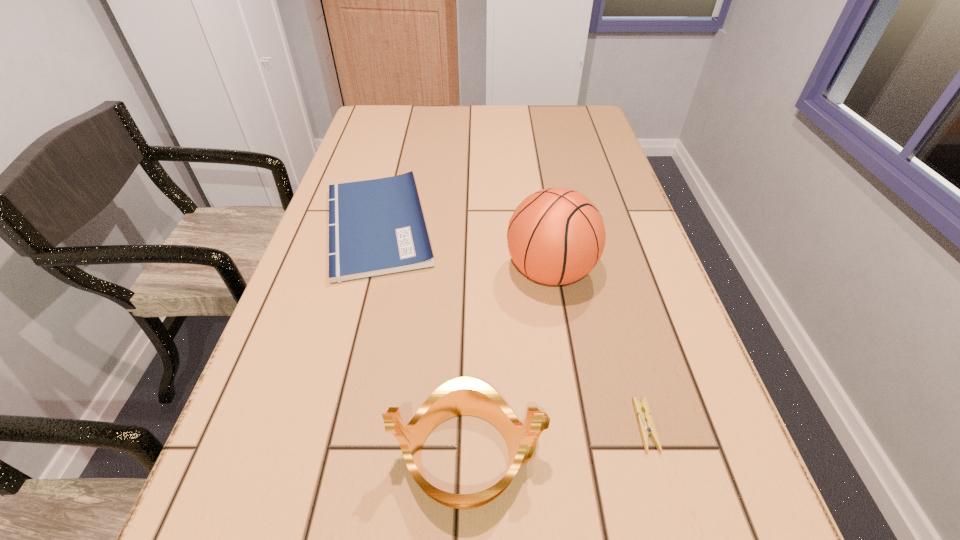
I want to click on the tallest object, so click(x=556, y=236).

Identify the location of tiara. The image size is (960, 540). (464, 395).

Find the location of a particular element. This screenshot has height=540, width=960. paperback book is located at coordinates (376, 227).

This screenshot has width=960, height=540. I want to click on clothespin, so click(647, 428).

Find the location of a particular element. The height and width of the screenshot is (540, 960). the shortest object is located at coordinates (647, 428).

You are a GUI agent. You are given a task and a screenshot of the screen. Output one action in this format:
    pyautogui.click(x=<x>, y=<y>)
    Task: Click on the free spot located 0.060m on the back of the basketball
    
    Given the screenshot: What is the action you would take?
    pyautogui.click(x=542, y=226)

Where is `vacant space located 0.220m at the front emblem of the tiara`? The width and height of the screenshot is (960, 540). vacant space located 0.220m at the front emblem of the tiara is located at coordinates (689, 455).

Identify the location of vacant space located on the back of the third tallest object. This screenshot has height=540, width=960. click(393, 169).

Locate an element on the screen. free space located 0.280m on the back of the rightmost object is located at coordinates (604, 279).

Find the location of a particular element. This screenshot has height=540, width=960. object that is positioned at the left edge is located at coordinates point(376,227).